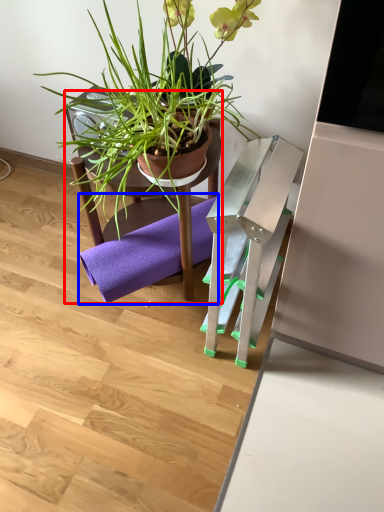
Question: Which object appears farthest to the camera in this image, chair (highlighted by a red box) or yoga mat (highlighted by a blue box)?

Choices:
 (A) chair
 (B) yoga mat

Answer: (B)